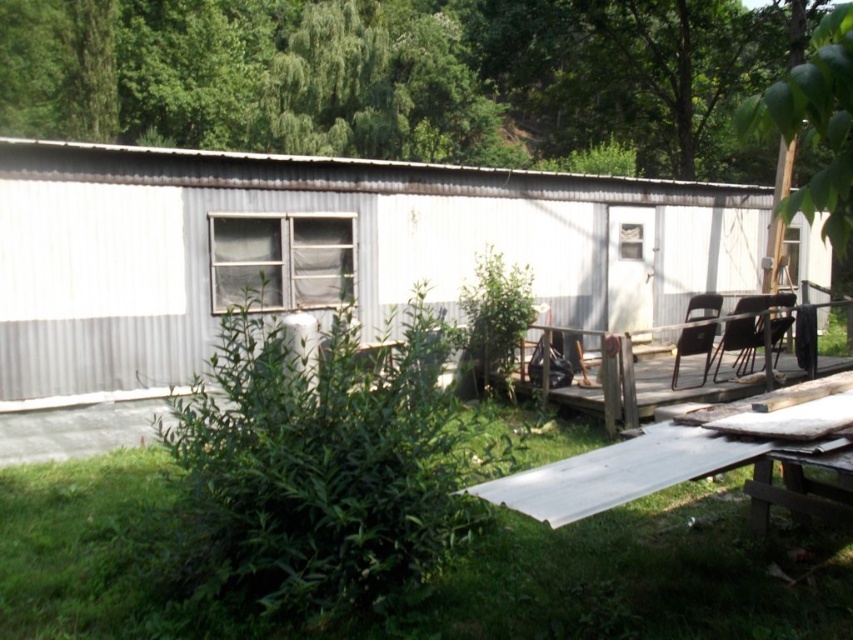
Question: Which object is positioned farthest from the brown wooden chair at center-right?

Choices:
 (A) green leafy tree at upper center
 (B) wooden deck at lower right
 (C) white corrugated metal hut at center
 (D) green leafy tree at upper right

Answer: (A)

Question: Which object is farther from the camera taking this photo?

Choices:
 (A) brown wooden chair at center-right
 (B) white corrugated metal hut at center
 (C) green leafy tree at upper right
 (D) metallic silver table at lower right

Answer: (A)

Question: Does white corrugated metal hut at center come behind brown wooden chair at center-right?

Choices:
 (A) no
 (B) yes

Answer: (A)

Question: Can you confirm if white corrugated metal hut at center is bigger than black plastic chair at lower right?

Choices:
 (A) no
 (B) yes

Answer: (B)

Question: Estimate the real-world distances between objects in this image. Which object is farther from the wooden deck at lower right?

Choices:
 (A) brown wooden chair at center-right
 (B) black plastic chair at lower right

Answer: (A)

Question: Does white corrugated metal hut at center appear under green leafy tree at upper right?

Choices:
 (A) no
 (B) yes

Answer: (B)